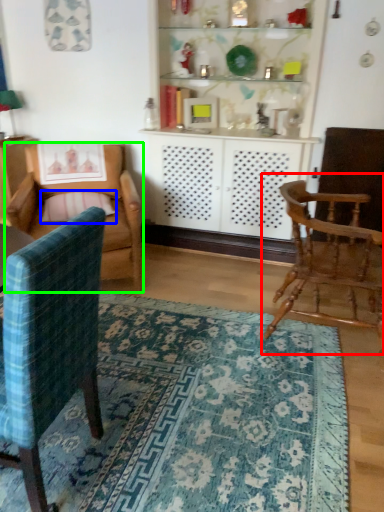
Question: Which object is positioned closest to chair (highlighted by a red box)? Select from pillow (highlighted by a blue box) and chair (highlighted by a green box).

Choices:
 (A) pillow
 (B) chair

Answer: (B)